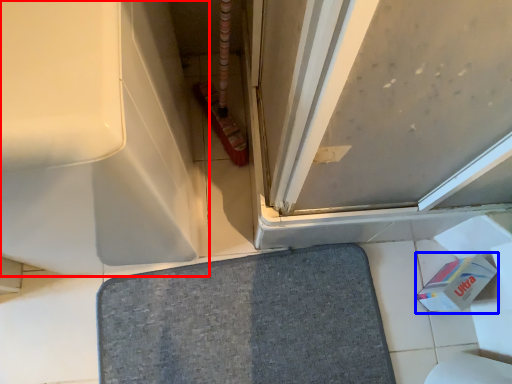
Question: Which point is further to the camera, bath (highlighted by a red box) or toilet paper (highlighted by a blue box)?

Choices:
 (A) bath
 (B) toilet paper

Answer: (B)